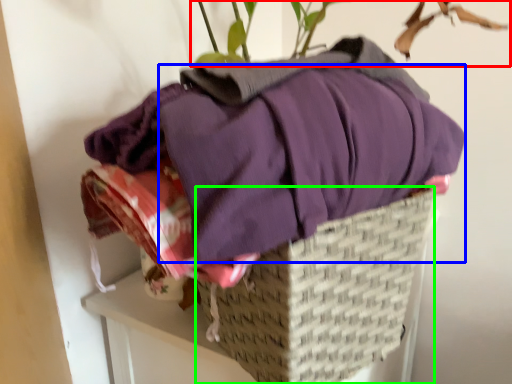
Question: Which object is positioned farthest from houseplant (highlighted by a red box)? Select from clothing (highlighted by a blue box) and basket (highlighted by a green box).

Choices:
 (A) clothing
 (B) basket

Answer: (B)